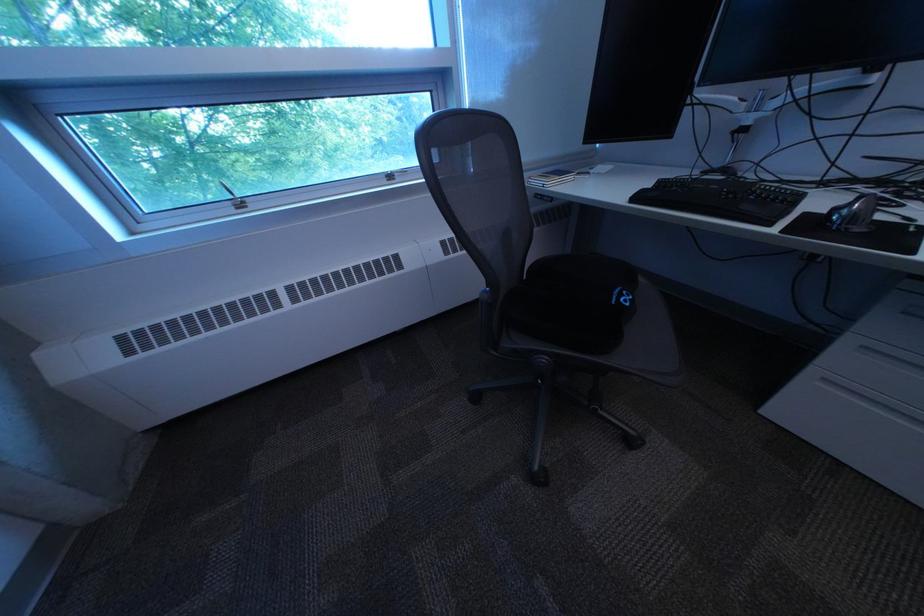
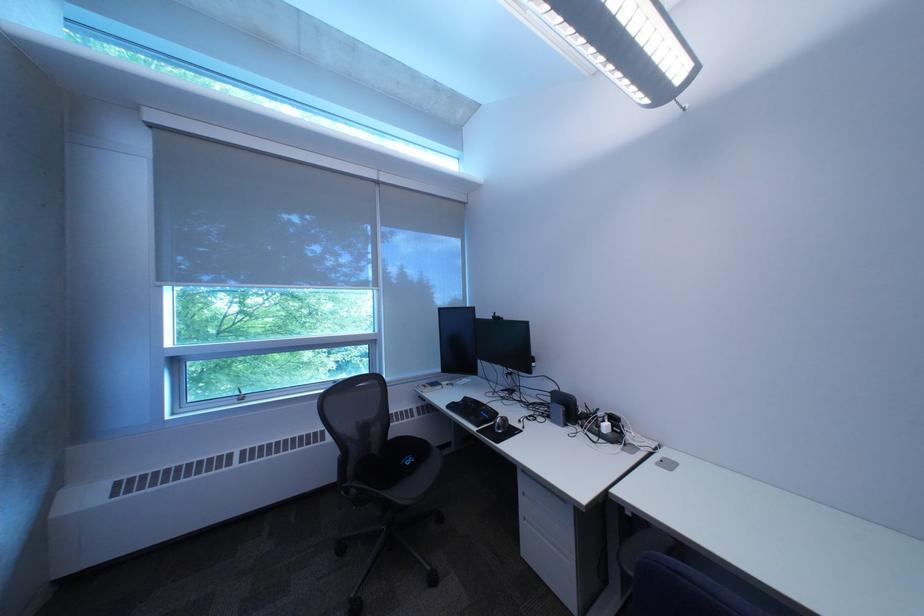
In the second image, find the point that corresponds to [833,140] in the first image.

(532, 387)